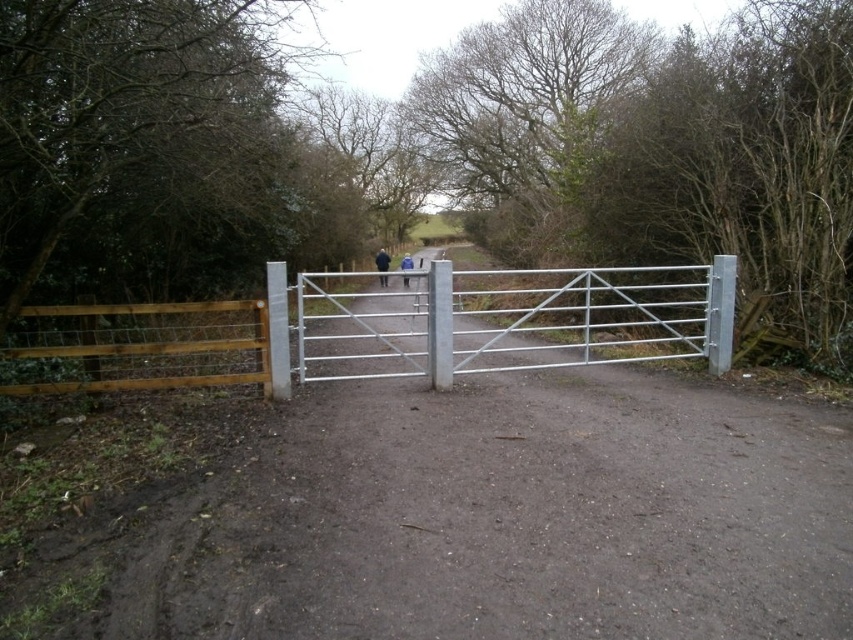
Question: Can you confirm if silver/galvanized metal gate at center is wider than blue fabric jacket at center?

Choices:
 (A) no
 (B) yes

Answer: (B)

Question: Observing the image, what is the correct spatial positioning of silver/galvanized metal gate at center in reference to blue fabric jacket at center?

Choices:
 (A) below
 (B) above

Answer: (A)

Question: Which is farther from the silver/galvanized metal gate at center?

Choices:
 (A) black fabric jacket at center
 (B) blue fabric jacket at center

Answer: (A)

Question: Which point is farther from the camera taking this photo?

Choices:
 (A) (376, 264)
 (B) (596, 342)

Answer: (A)

Question: Which of these objects is positioned closest to the silver/galvanized metal gate at center?

Choices:
 (A) blue fabric jacket at center
 (B) black fabric jacket at center

Answer: (A)

Question: Is silver/galvanized metal gate at center smaller than blue fabric jacket at center?

Choices:
 (A) no
 (B) yes

Answer: (A)